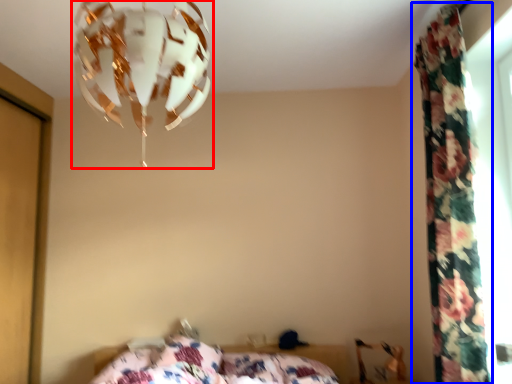
Question: Which point is closer to the camera, lamp (highlighted by a red box) or curtain (highlighted by a blue box)?

Choices:
 (A) lamp
 (B) curtain

Answer: (A)